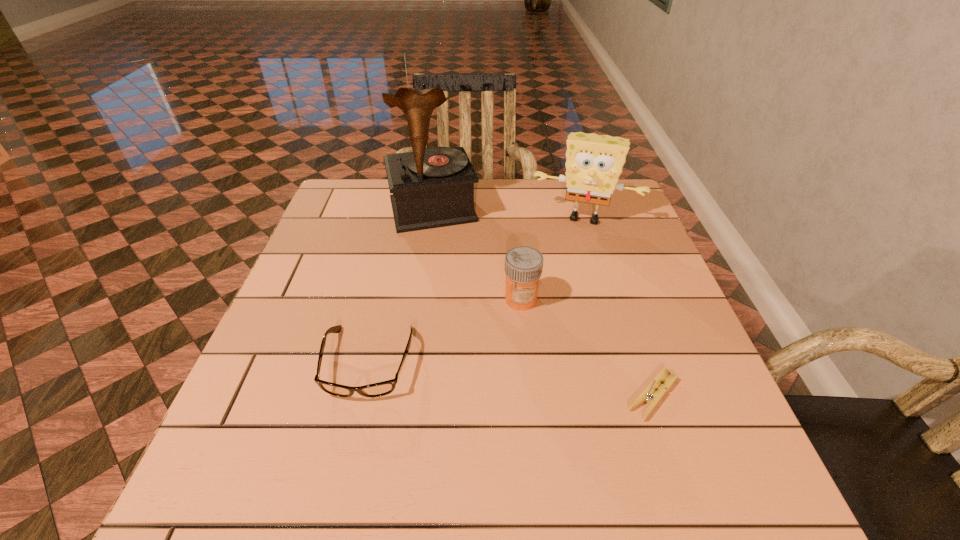
At what (x,y) coordinates should I click in order to perform the action: click on the second shortest object. Please return your answer as a coordinate pair (x, y). The height and width of the screenshot is (540, 960). Looking at the image, I should click on (379, 389).

Identify the location of clothespin. (650, 395).

This screenshot has height=540, width=960. Identify the location of the third nearest object. (523, 265).

You are a GUI agent. You are given a task and a screenshot of the screen. Output one action in this format:
    pyautogui.click(x=<x>, y=<y>)
    Task: Click on the third shortest object
    
    Given the screenshot: What is the action you would take?
    pyautogui.click(x=523, y=265)

Find the location of a particular element. sponge is located at coordinates (594, 163).

Find the location of a particular element. This screenshot has width=960, height=540. the tallest object is located at coordinates (433, 187).

Locate an element on the screen. vacant region located 0.070m on the front-facing side of the spectacles is located at coordinates (350, 440).

Locate an element on the screen. This screenshot has height=540, width=960. vacant point located 0.290m on the left of the clothespin is located at coordinates (468, 396).

I want to click on free space located on the label side of the third tallest object, so click(482, 354).

This screenshot has width=960, height=540. What are the coordinates of `free spot located on the label side of the third tallest object` in the screenshot? It's located at (461, 383).